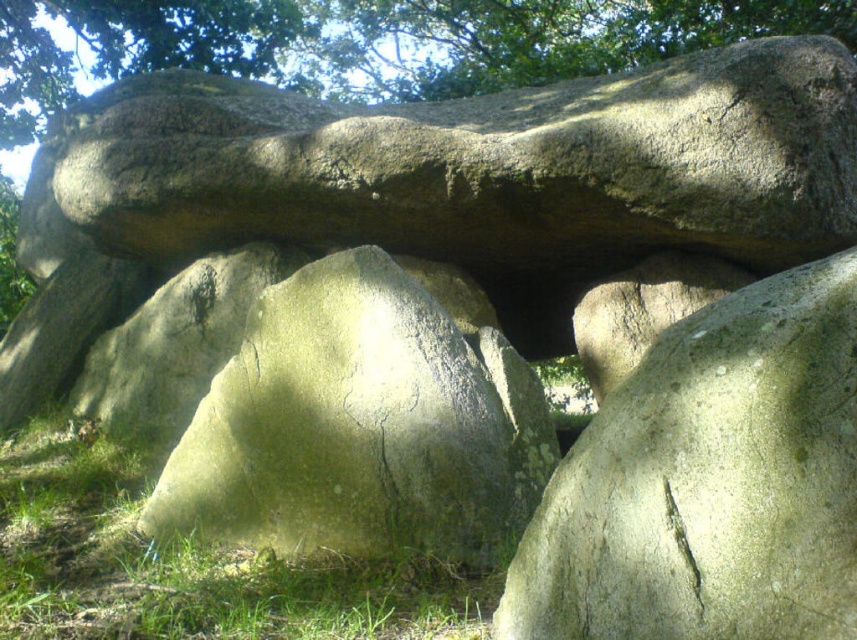
You are an archaeologist examining the gray rough rock at upper center in the stone structure. What are the exact coordinates of its position in the image?

The gray rough rock at upper center is located at the 2D coordinates of point (x=483, y=163).

You are a hiker who wants to take a photo of the gray rough rock at upper center and the green grass at lower left. Which object should you focus on first if you want both to be in sharp focus?

You should focus on the gray rough rock at upper center first because it is taller than the green grass at lower left, so focusing on the farther object ensures both will be in focus.

You are standing at the base of the stone structure and looking towards the upper center. You see the gray rough rock at upper center and the green leafy tree at upper center. Which object is positioned to the left of the other?

The gray rough rock at upper center is to the left of the green leafy tree at upper center.